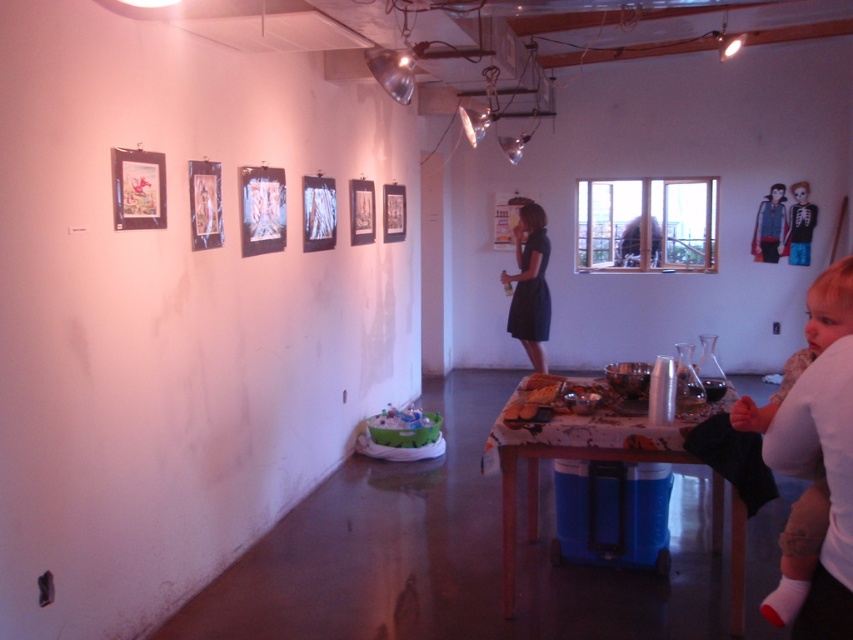
Based on the photo, you are an interior designer planning to place a rectangular decorative item on the table. The item is 1.2 meters wide. Given the space occupied by the light brown fabric baby at lower right and the blue denim jacket at upper right, can you determine if the item will fit on the table?

The light brown fabric baby at lower right is wider than the blue denim jacket at upper right. However, since the decorative item is 1.2 meters wide, and the table has scattered items including the larger light brown fabric baby at lower right, it is uncertain if there is enough space. The table might be too cluttered to accommodate such a large item without rearrangement.

You are an interior designer planning to rearrange the items in the gallery room. You need to know which object takes up more space between the matte paper paintings at upper center and the light brown fabric baby at lower right. Which one should you consider for space allocation?

The light brown fabric baby at lower right occupies more space than the matte paper paintings at upper center, so you should consider it for space allocation.